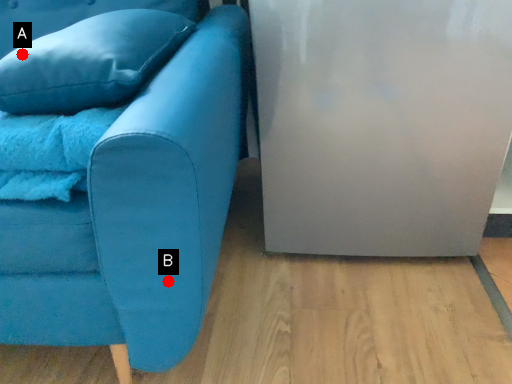
Question: Two points are circled on the image, labeled by A and B beside each circle. Among these points, which one is farthest from the camera?

Choices:
 (A) A is further
 (B) B is further

Answer: (A)